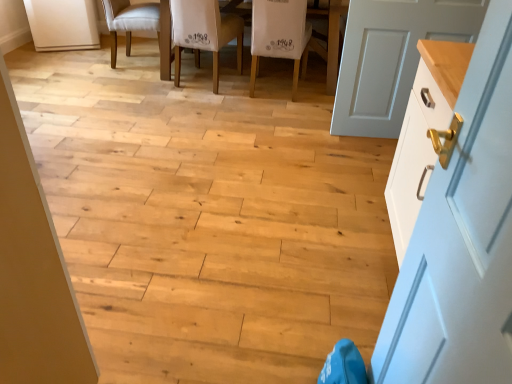
Question: Considering the relative positions of wooden floor at center and white fabric chair at center, which is the 2th chair from right to left, in the image provided, is wooden floor at center to the left of white fabric chair at center, which is the 2th chair from right to left, from the viewer's perspective?

Choices:
 (A) no
 (B) yes

Answer: (B)

Question: Is wooden floor at center placed right next to white fabric chair at center, the 2th chair when ordered from left to right?

Choices:
 (A) no
 (B) yes

Answer: (A)

Question: Does wooden floor at center have a smaller size compared to white fabric chair at center, which is the 2th chair from right to left?

Choices:
 (A) no
 (B) yes

Answer: (A)

Question: Is the position of wooden floor at center less distant than that of white fabric chair at center, the 2th chair when ordered from left to right?

Choices:
 (A) yes
 (B) no

Answer: (A)

Question: Is wooden floor at center aimed at white fabric chair at center, the 2th chair when ordered from left to right?

Choices:
 (A) yes
 (B) no

Answer: (B)

Question: Is wooden floor at center looking in the opposite direction of white fabric chair at center, the 2th chair when ordered from left to right?

Choices:
 (A) no
 (B) yes

Answer: (A)

Question: From a real-world perspective, is wooden table at center over white glossy door at right, the 1th door positioned from the front?

Choices:
 (A) yes
 (B) no

Answer: (B)

Question: Could white glossy door at right, placed as the 1th door when sorted from left to right, be considered to be inside wooden table at center?

Choices:
 (A) no
 (B) yes

Answer: (A)

Question: From the image's perspective, is wooden table at center beneath white glossy door at right, placed as the 1th door when sorted from left to right?

Choices:
 (A) yes
 (B) no

Answer: (B)

Question: Is wooden table at center closer to the viewer compared to white glossy door at right, positioned as the first door in bottom-to-top order?

Choices:
 (A) yes
 (B) no

Answer: (B)

Question: Is wooden table at center facing towards white glossy door at right, placed as the 1th door when sorted from left to right?

Choices:
 (A) yes
 (B) no

Answer: (A)

Question: Does wooden table at center have a smaller size compared to white glossy door at right, positioned as the first door in bottom-to-top order?

Choices:
 (A) no
 (B) yes

Answer: (A)

Question: From the image's perspective, does white painted wood door at right, positioned as the 1th door in right-to-left order, appear lower than white fabric chair at center, marked as the first chair in a right-to-left arrangement?

Choices:
 (A) yes
 (B) no

Answer: (A)